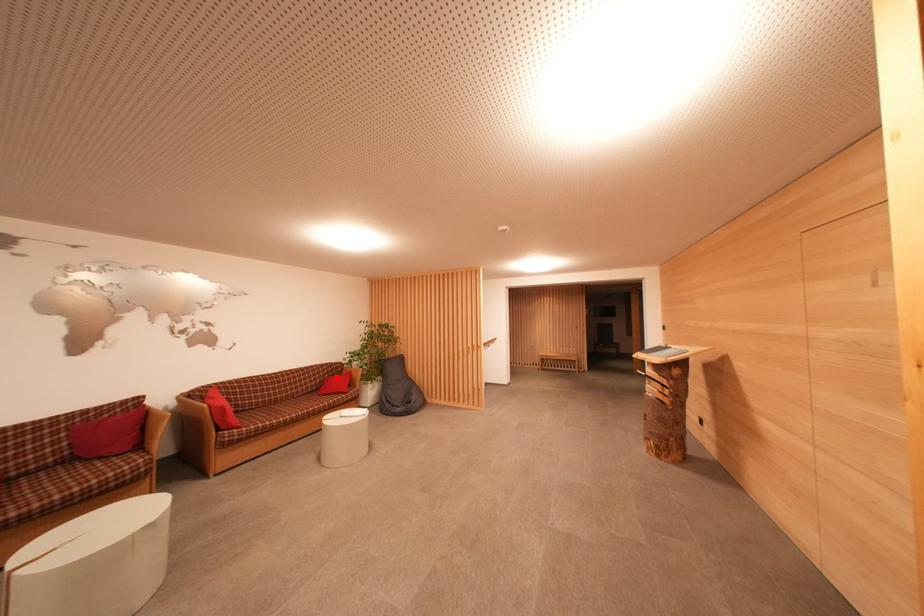
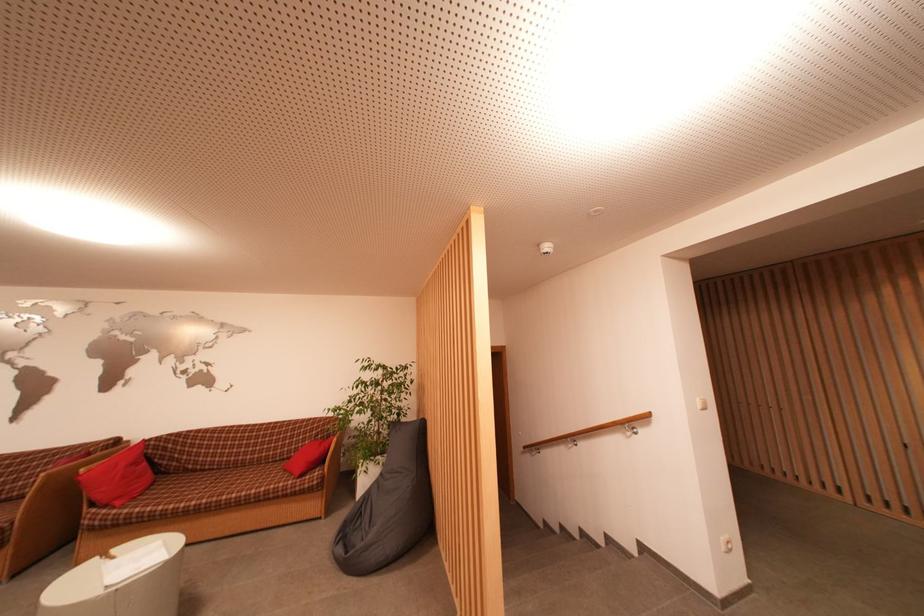
Question: I am providing you with two images of the same scene from different viewpoints. Given a red point in image1, look at the same physical point in image2. Is it:

Choices:
 (A) Closer to the viewpoint
 (B) Farther from the viewpoint

Answer: (B)